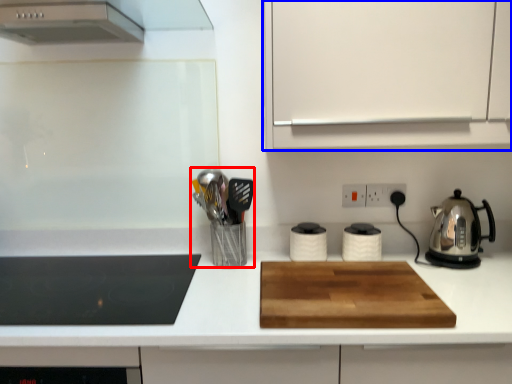
Question: Which object appears closest to the camera in this image, appliance (highlighted by a red box) or cabinetry (highlighted by a blue box)?

Choices:
 (A) appliance
 (B) cabinetry

Answer: (B)